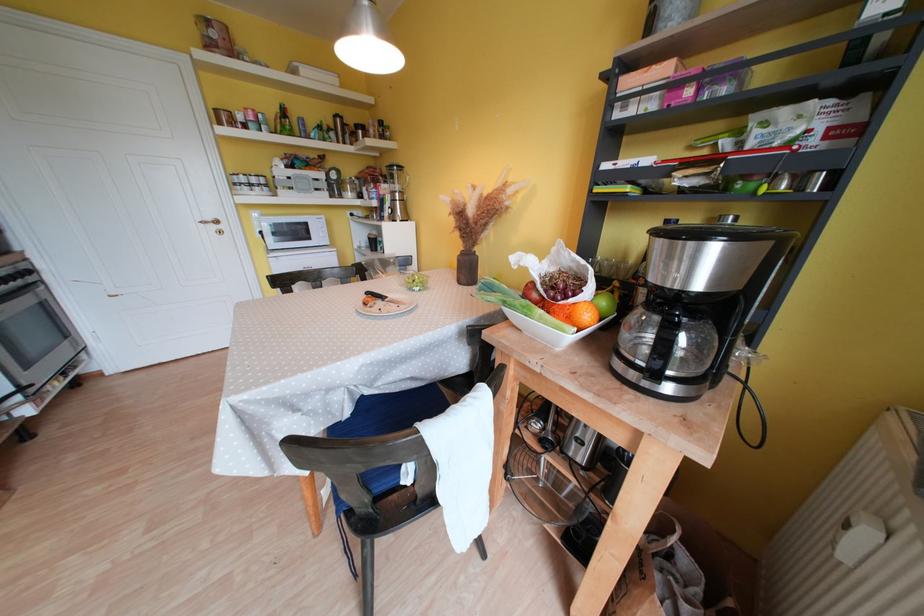
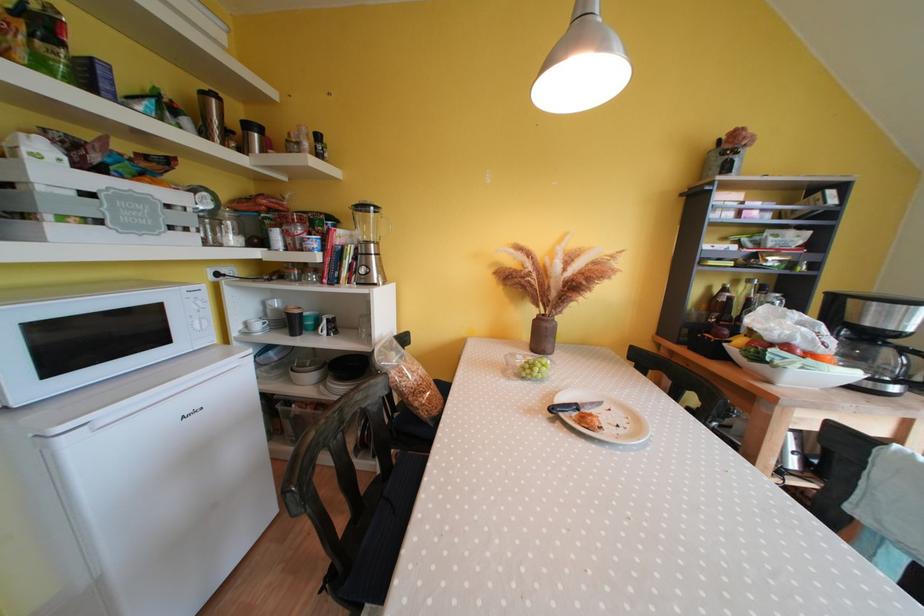
The point at (370, 248) is marked in the first image. Where is the corresponding point in the second image?

(264, 330)